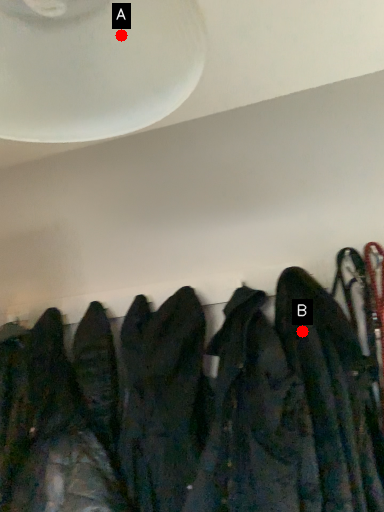
Question: Two points are circled on the image, labeled by A and B beside each circle. Which point is closer to the camera?

Choices:
 (A) A is closer
 (B) B is closer

Answer: (A)